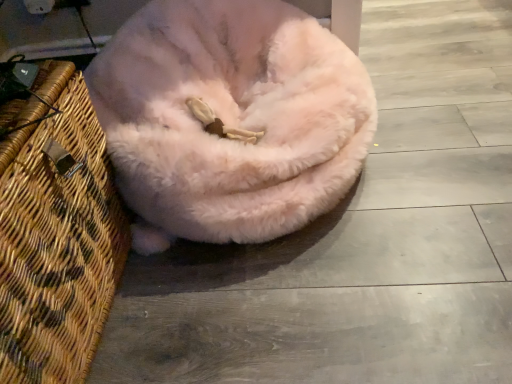
Find the location of `vacant point to the right of pink fluffy dog bed at center`. vacant point to the right of pink fluffy dog bed at center is located at coordinates (442, 151).